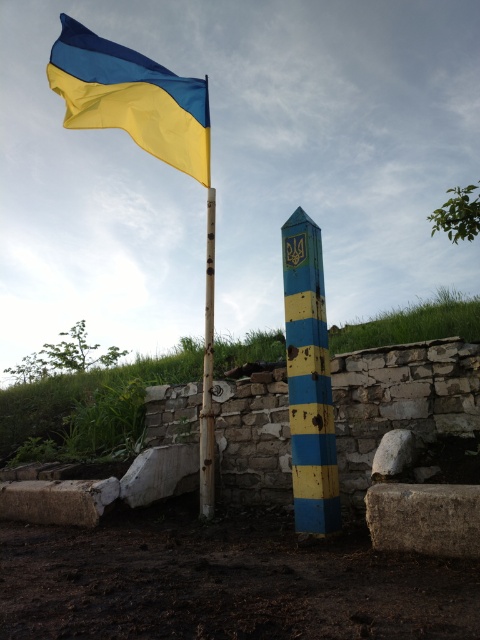
Is yellow-blue fabric flag at upper left taller than blue/yellow striped pole at center?

No.

Does yellow-blue fabric flag at upper left have a greater width compared to blue/yellow striped pole at center?

Yes.

Does point (176, 148) come closer to viewer compared to point (294, 451)?

No, it is behind (294, 451).

At what (x,y) coordinates should I click in order to perform the action: click on yellow-blue fabric flag at upper left. Please return your answer as a coordinate pair (x, y). This screenshot has height=640, width=480. Looking at the image, I should click on (132, 97).

Between point (297, 404) and point (213, 205), which one is positioned in front?

Point (297, 404) is more forward.

Is point (305, 381) farther from viewer compared to point (205, 282)?

That is False.

Locate an element on the screen. The width and height of the screenshot is (480, 640). blue/yellow striped pole at center is located at coordinates (309, 380).

Does yellow-blue fabric flag at upper left have a smaller size compared to smooth wood pole at center?

No, yellow-blue fabric flag at upper left is not smaller than smooth wood pole at center.

Can you confirm if yellow-blue fabric flag at upper left is bigger than smooth wood pole at center?

Indeed, yellow-blue fabric flag at upper left has a larger size compared to smooth wood pole at center.

Which is in front, point (188, 83) or point (210, 378)?

Positioned in front is point (210, 378).

Identify the location of yellow-blue fabric flag at upper left. (132, 97).